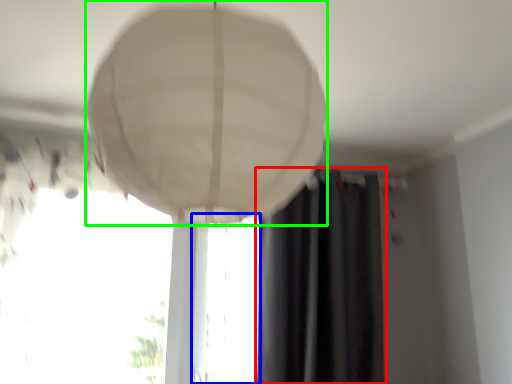
Question: Estimate the real-world distances between objects in this image. Which object is farther from curtain (highlighted by a red box), window (highlighted by a blue box) or lamp (highlighted by a green box)?

Choices:
 (A) window
 (B) lamp

Answer: (B)